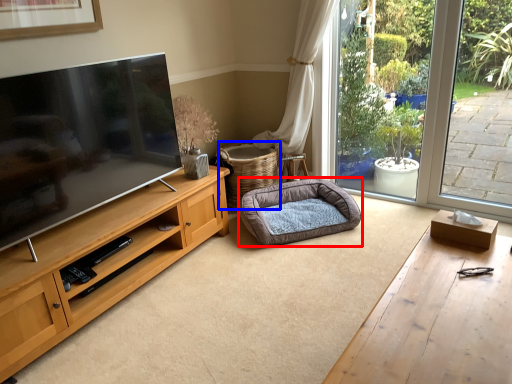
Question: Which object is closer to the camera taking this photo, dog bed (highlighted by a red box) or basket (highlighted by a blue box)?

Choices:
 (A) dog bed
 (B) basket

Answer: (A)